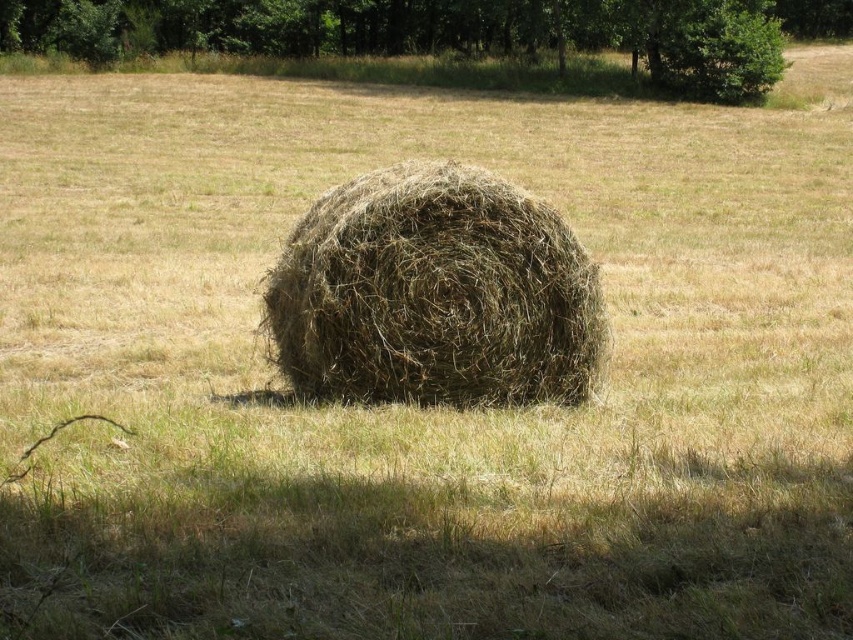
You are a farmer checking the hay bale in the field. You notice the brown textured hay at center and the green leafy tree at upper center. Which object is closer to the ground?

The brown textured hay at center is closer to the ground because it is positioned under the green leafy tree at upper center.

You are standing in the middle of the field looking towards the trees. You notice two points marked in the image. Which point, point (x=532, y=339) or point (x=641, y=19), is closer to you?

Point (x=532, y=339) is closer to the viewer than point (x=641, y=19).

You are standing in the field and want to walk towards the green leafy tree at upper center. Which direction should you move relative to the brown textured hay at center?

You should move to the left of the brown textured hay at center because the brown textured hay at center is to the right of the green leafy tree at upper center, so the tree is to the left of the hay bale.